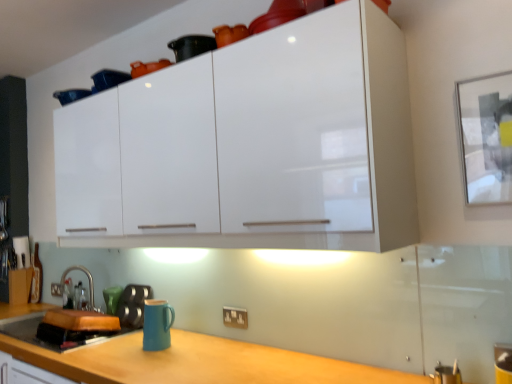
Question: From the image's perspective, is matte blue mug at lower center located beneath white glossy cabinet at upper center?

Choices:
 (A) yes
 (B) no

Answer: (A)

Question: Is matte blue mug at lower center at the right side of white glossy cabinet at upper center?

Choices:
 (A) yes
 (B) no

Answer: (B)

Question: Is matte blue mug at lower center not close to white glossy cabinet at upper center?

Choices:
 (A) yes
 (B) no

Answer: (B)

Question: Is matte blue mug at lower center at the left side of white glossy cabinet at upper center?

Choices:
 (A) no
 (B) yes

Answer: (B)

Question: Considering the relative sizes of matte blue mug at lower center and white glossy cabinet at upper center in the image provided, is matte blue mug at lower center bigger than white glossy cabinet at upper center?

Choices:
 (A) no
 (B) yes

Answer: (A)

Question: Visually, is white glossy cabinet at upper center positioned to the left or to the right of matte black kettle at lower left?

Choices:
 (A) right
 (B) left

Answer: (A)

Question: Is white glossy cabinet at upper center wider or thinner than matte black kettle at lower left?

Choices:
 (A) wide
 (B) thin

Answer: (A)

Question: Looking at the image, does white glossy cabinet at upper center seem bigger or smaller compared to matte black kettle at lower left?

Choices:
 (A) big
 (B) small

Answer: (A)

Question: Is point (244, 84) closer or farther from the camera than point (129, 321)?

Choices:
 (A) farther
 (B) closer

Answer: (B)

Question: From the image's perspective, is matte blue mug at lower center located above or below white glossy cabinet at upper center?

Choices:
 (A) above
 (B) below

Answer: (B)

Question: From their relative heights in the image, would you say matte blue mug at lower center is taller or shorter than white glossy cabinet at upper center?

Choices:
 (A) short
 (B) tall

Answer: (A)

Question: From a real-world perspective, is matte blue mug at lower center above or below white glossy cabinet at upper center?

Choices:
 (A) below
 (B) above

Answer: (A)

Question: Is point (159, 337) positioned closer to the camera than point (225, 220)?

Choices:
 (A) farther
 (B) closer

Answer: (A)

Question: Considering the relative positions of satin nickel faucet at lower left and teal ceramic mug at lower left in the image provided, is satin nickel faucet at lower left to the left or to the right of teal ceramic mug at lower left?

Choices:
 (A) left
 (B) right

Answer: (A)

Question: In terms of size, does satin nickel faucet at lower left appear bigger or smaller than teal ceramic mug at lower left?

Choices:
 (A) small
 (B) big

Answer: (B)